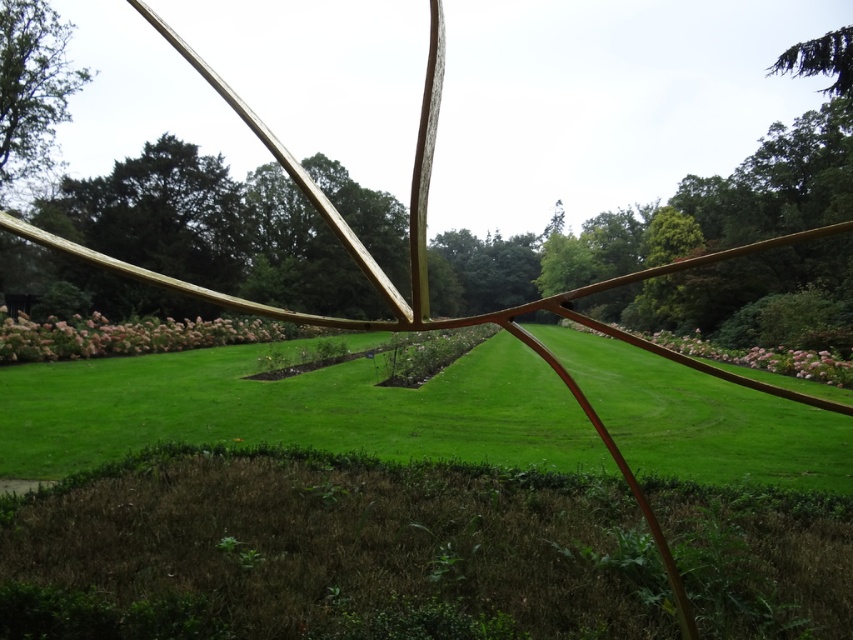
You are standing in the garden and want to take a photo of both the green leafy tree at upper left and the pink fluffy flowers at center. Which object should you focus on first to ensure both are in clear view?

You should focus on the green leafy tree at upper left first because it is closer to you than the pink fluffy flowers at center, so adjusting focus from near to far will help both be in clear view.

You are standing in the garden and want to take a photo of both the green leafy tree at upper left and the pink fluffy flowers at center. Which object appears narrower in the photo?

The green leafy tree at upper left appears narrower in the photo because it has a lesser width compared to the pink fluffy flowers at center.